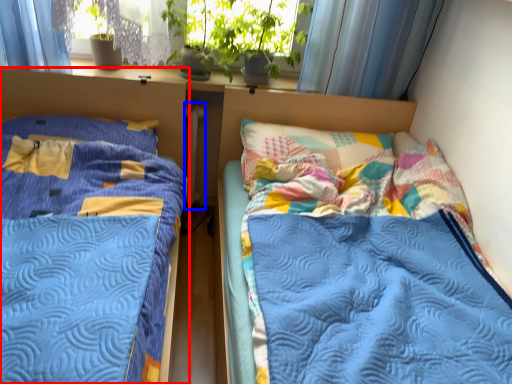
Question: Among these objects, which one is farthest to the camera, bed (highlighted by a red box) or radiator (highlighted by a blue box)?

Choices:
 (A) bed
 (B) radiator

Answer: (B)